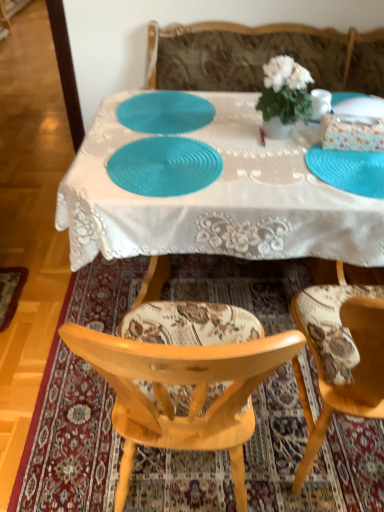
Locate an element on the screen. This screenshot has width=384, height=512. free space above blue textured placemat at center, the 1th plate positioned from the left (from a real-world perspective) is located at coordinates (174, 112).